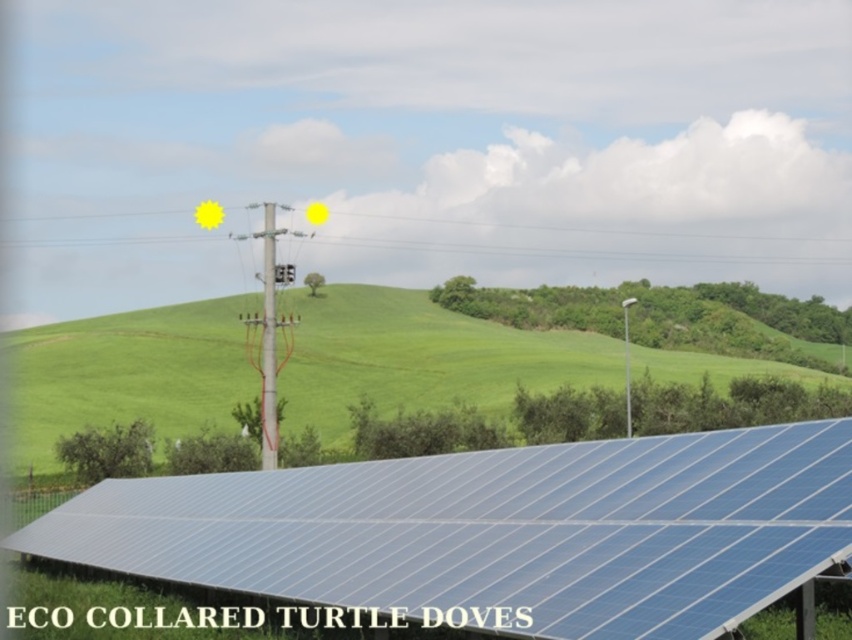
Question: Which point is farther to the camera?

Choices:
 (A) (30, 346)
 (B) (629, 637)

Answer: (A)

Question: Does blue solar panel at lower center have a smaller size compared to green grassy hillside at center?

Choices:
 (A) yes
 (B) no

Answer: (A)

Question: Is blue solar panel at lower center to the right of green grassy hillside at center from the viewer's perspective?

Choices:
 (A) yes
 (B) no

Answer: (A)

Question: Among these points, which one is farthest from the camera?

Choices:
 (A) (496, 326)
 (B) (833, 435)

Answer: (A)

Question: Is blue solar panel at lower center thinner than green grassy hillside at center?

Choices:
 (A) no
 (B) yes

Answer: (B)

Question: Which object is closer to the camera taking this photo?

Choices:
 (A) blue solar panel at lower center
 (B) green grassy hillside at center

Answer: (A)